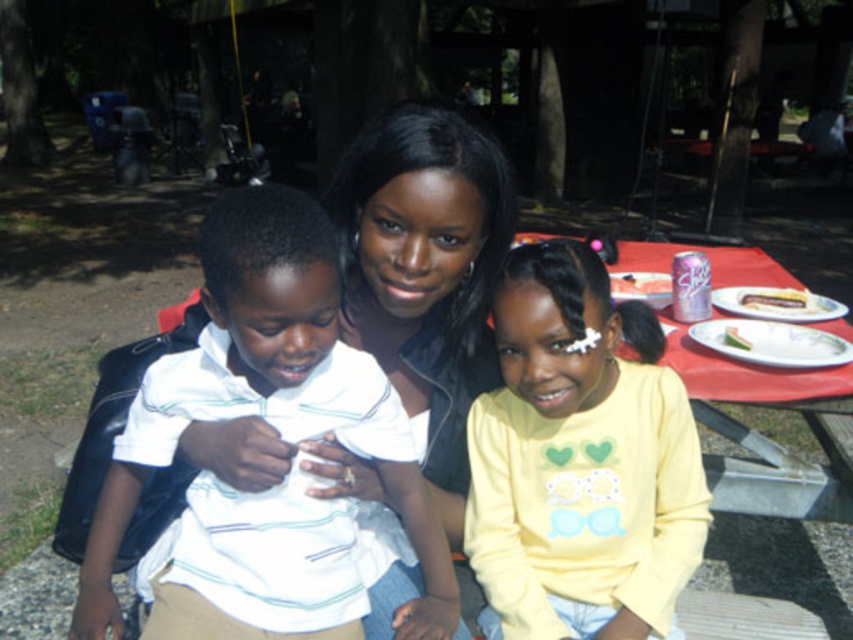
Question: Which of the following is the farthest from the observer?

Choices:
 (A) white paper plate at center right
 (B) white striped shirt at center

Answer: (A)

Question: Can you confirm if white paper plate at center right is positioned to the left of green leafy vegetable at center?

Choices:
 (A) yes
 (B) no

Answer: (B)

Question: Does white striped shirt at center appear on the left side of white porcelain plate at right?

Choices:
 (A) no
 (B) yes

Answer: (B)

Question: Is yellow matte shirt at center thinner than chocolate cake at right?

Choices:
 (A) no
 (B) yes

Answer: (A)

Question: Which point is closer to the camera?

Choices:
 (A) (833, 356)
 (B) (202, 493)
 (C) (746, 342)
 (D) (764, 301)

Answer: (B)

Question: Which of the following is the closest to the observer?

Choices:
 (A) (730, 344)
 (B) (785, 291)
 (C) (497, 621)

Answer: (C)